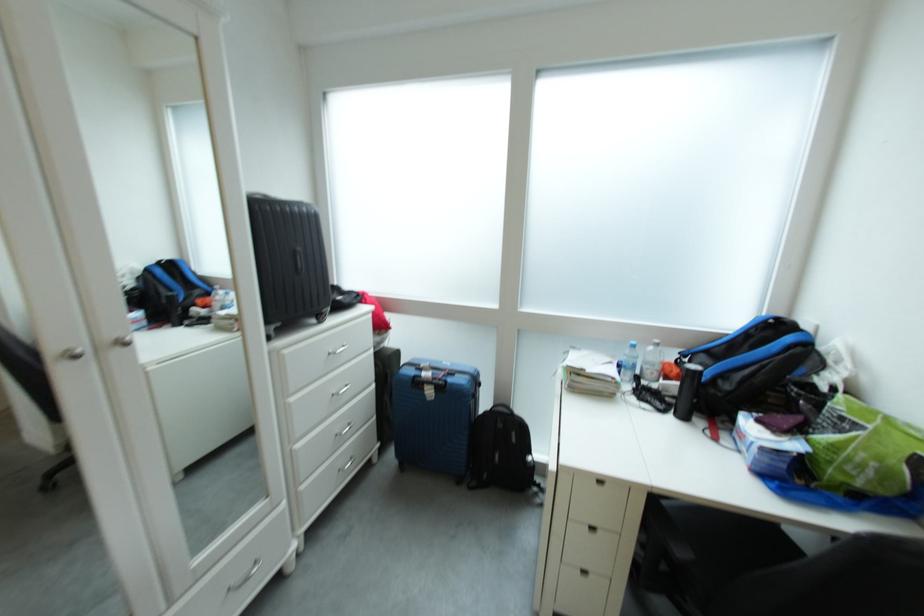
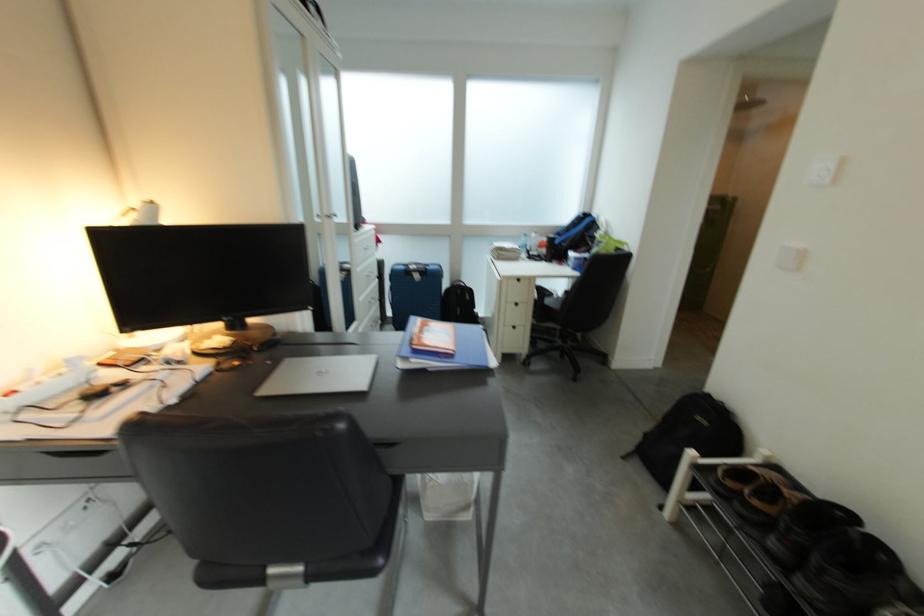
What movement of the cameraman would produce the second image?

The movement direction of the cameraman is left, backward.